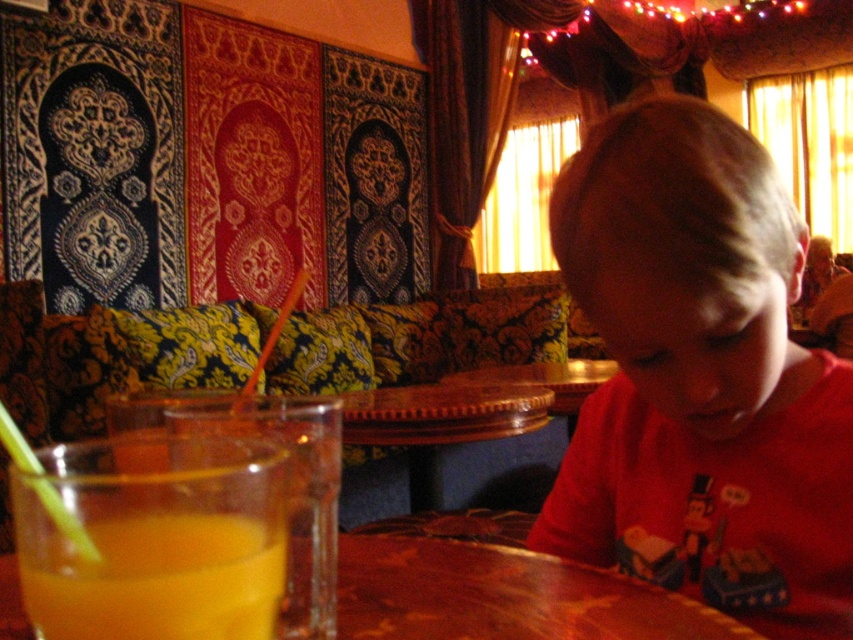
You are a photographer adjusting your camera settings to focus on the red matte shirt at lower right and the wooden table at center. Which object should you adjust your focus to first if you want to capture both in sharp detail?

The red matte shirt at lower right is bigger than the wooden table at center, so you should focus on the red matte shirt at lower right first to ensure its larger size is captured sharply before adjusting for the smaller wooden table at center.

You are a photographer adjusting your camera to focus on the red matte shirt at lower right and the wooden table at center. Which object should you focus on first if you want to capture both in sharp detail?

The red matte shirt at lower right is much taller than the wooden table at center, so you should focus on the red matte shirt at lower right first to ensure both are in sharp detail.